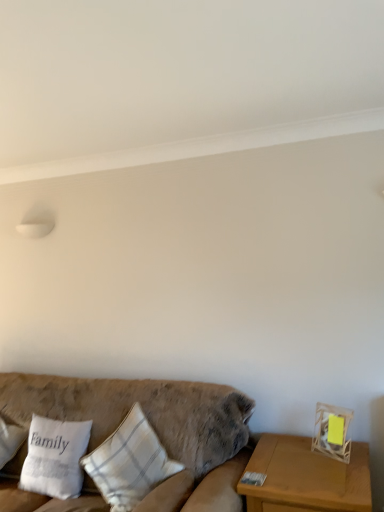
Question: Is white cotton pillow at left, the third pillow viewed from the left, in front of or behind velvet beige couch at lower left in the image?

Choices:
 (A) front
 (B) behind

Answer: (B)

Question: Is white cotton pillow at left, the third pillow viewed from the left, wider or thinner than velvet beige couch at lower left?

Choices:
 (A) wide
 (B) thin

Answer: (B)

Question: Which of these objects is positioned farthest from the velvet beige couch at lower left?

Choices:
 (A) white fabric pillow at lower left, the second pillow when ordered from right to left
 (B) wooden table at right
 (C) white cotton pillow at left, which ranks as the 1th pillow in right-to-left order
 (D) white fabric pillow at left, which is the 1th pillow in left-to-right order

Answer: (D)

Question: Which of these objects is positioned farthest from the velvet beige couch at lower left?

Choices:
 (A) white cotton pillow at left, which ranks as the 1th pillow in right-to-left order
 (B) wooden table at right
 (C) white fabric pillow at lower left, placed as the 2th pillow when sorted from left to right
 (D) white fabric pillow at left, positioned as the 3th pillow in right-to-left order

Answer: (D)